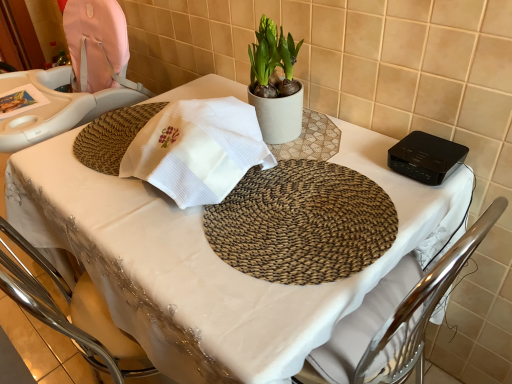
Where is `spots to the right of matte beige pot at center`? spots to the right of matte beige pot at center is located at coordinates (338, 134).